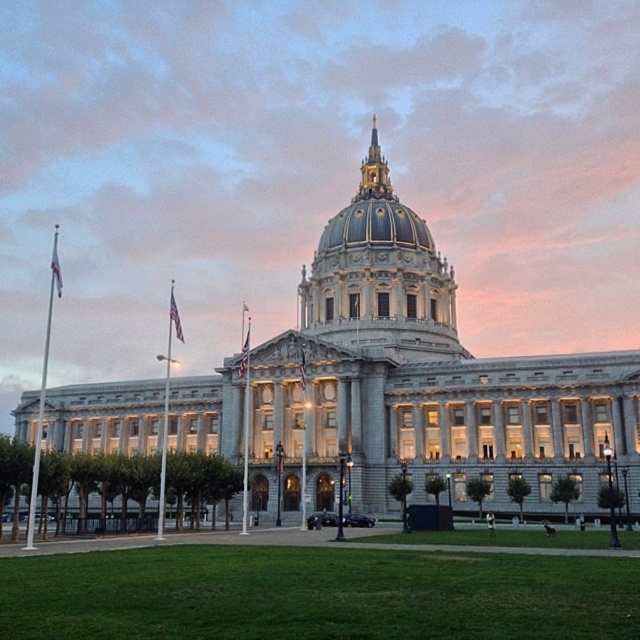
Which is above, green grass at lower center or blue/golden dome at center?

blue/golden dome at center is higher up.

Who is positioned more to the right, green grass at lower center or blue/golden dome at center?

Positioned to the right is blue/golden dome at center.

Locate an element on the screen. Image resolution: width=640 pixels, height=640 pixels. green grass at lower center is located at coordinates (316, 595).

Is point (602, 472) positioned after point (634, 566)?

That is True.

Who is more distant from viewer, (337, 440) or (384, 632)?

The point (337, 440) is behind.

Does point (605, 410) come behind point (148, 609)?

Yes, point (605, 410) is behind point (148, 609).

Where is `gray stone building at center`? gray stone building at center is located at coordinates (420, 380).

The width and height of the screenshot is (640, 640). What do you see at coordinates (420, 380) in the screenshot?
I see `gray stone building at center` at bounding box center [420, 380].

Who is positioned more to the left, gray stone building at center or gold/gilded dome at center?

gray stone building at center

Does point (269, 397) lie in front of point (324, 250)?

Yes, it is in front of point (324, 250).

The width and height of the screenshot is (640, 640). Identify the location of gray stone building at center. (420, 380).